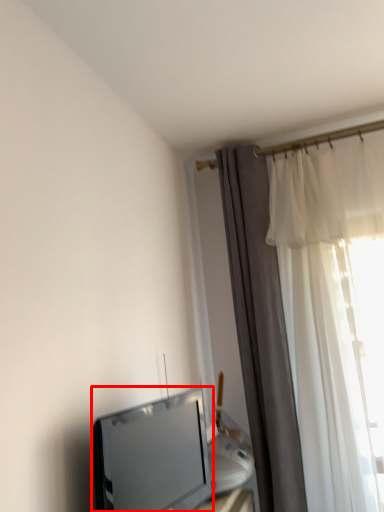
Question: From the image's perspective, where is television (annotated by the red box) located relative to curtain?

Choices:
 (A) below
 (B) above

Answer: (A)